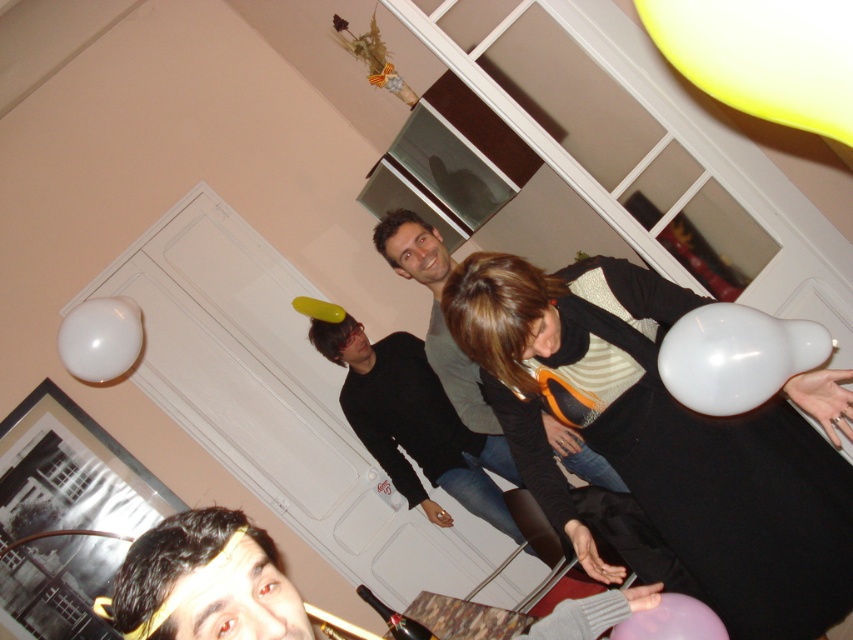
Question: Which point is farther from the camera taking this photo?

Choices:
 (A) (195, 621)
 (B) (769, 388)
 (C) (65, 356)

Answer: (C)

Question: Does yellow matte balloon at upper right appear on the right side of black matte shirt at center?

Choices:
 (A) yes
 (B) no

Answer: (A)

Question: Does shiny gold headband at lower left have a smaller size compared to white glossy balloon at upper left?

Choices:
 (A) no
 (B) yes

Answer: (B)

Question: Estimate the real-world distances between objects in this image. Which object is closer to the black matte shirt at center?

Choices:
 (A) white glossy balloon at upper left
 (B) yellow rubber balloon at upper center
 (C) shiny gold headband at lower left
 (D) matte black sweater at center

Answer: (B)

Question: Based on their relative distances, which object is nearer to the yellow matte balloon at upper right?

Choices:
 (A) matte black sweater at center
 (B) white glossy balloon at upper left

Answer: (A)

Question: Is shiny gold headband at lower left positioned in front of purple matte balloon at lower right?

Choices:
 (A) no
 (B) yes

Answer: (B)